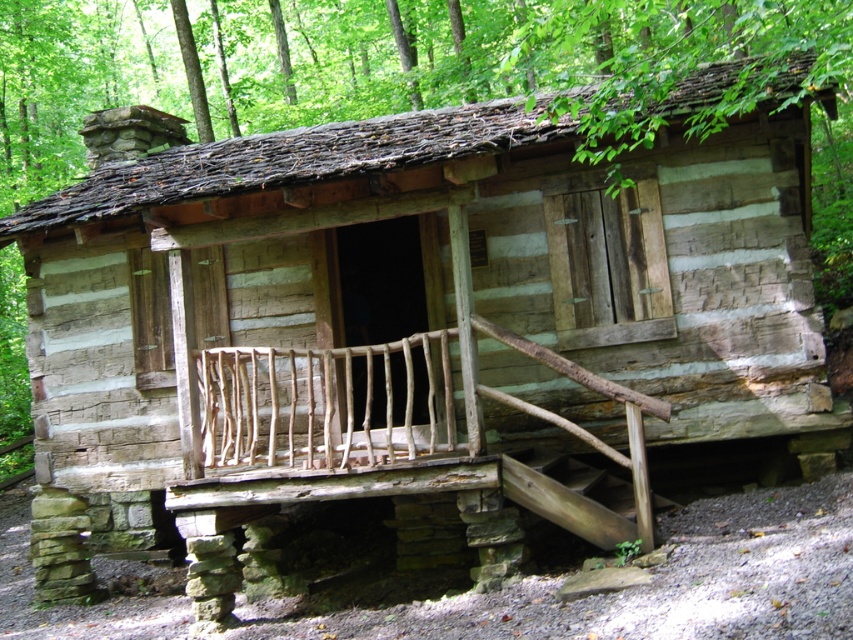
Question: Which of the following is the farthest from the observer?

Choices:
 (A) wooden stairs at lower center
 (B) rustic wooden porch at center

Answer: (B)

Question: Does rustic wooden porch at center appear over wooden stairs at lower center?

Choices:
 (A) yes
 (B) no

Answer: (A)

Question: Is rustic wooden porch at center to the left of wooden stairs at lower center from the viewer's perspective?

Choices:
 (A) no
 (B) yes

Answer: (B)

Question: Is rustic wooden porch at center thinner than wooden stairs at lower center?

Choices:
 (A) no
 (B) yes

Answer: (A)